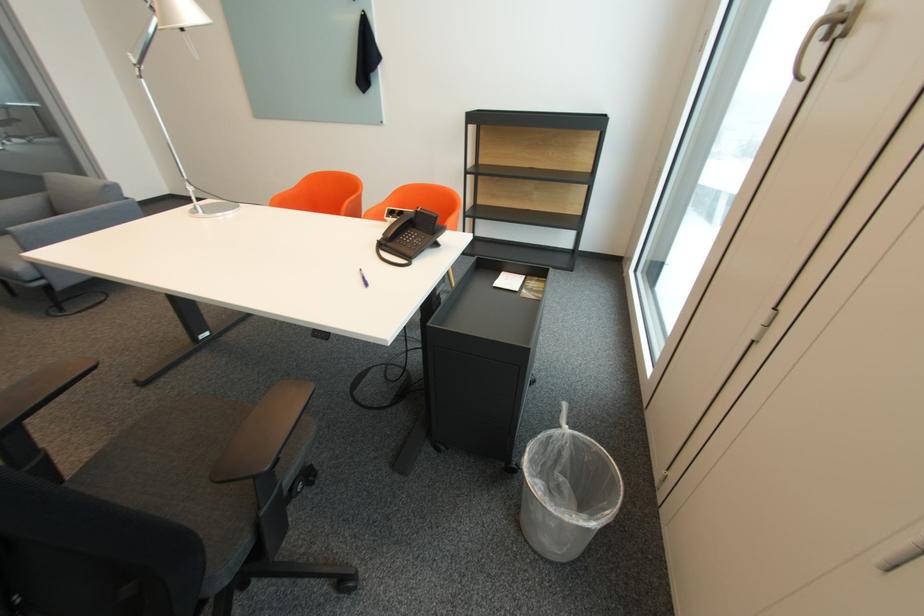
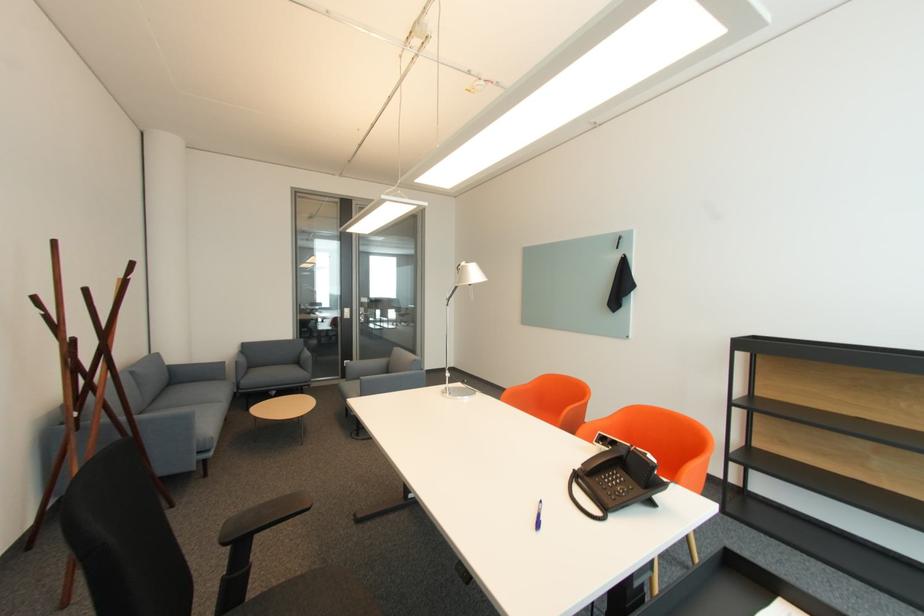
In the second image, find the point that corresponds to [395,236] in the first image.

(594, 469)